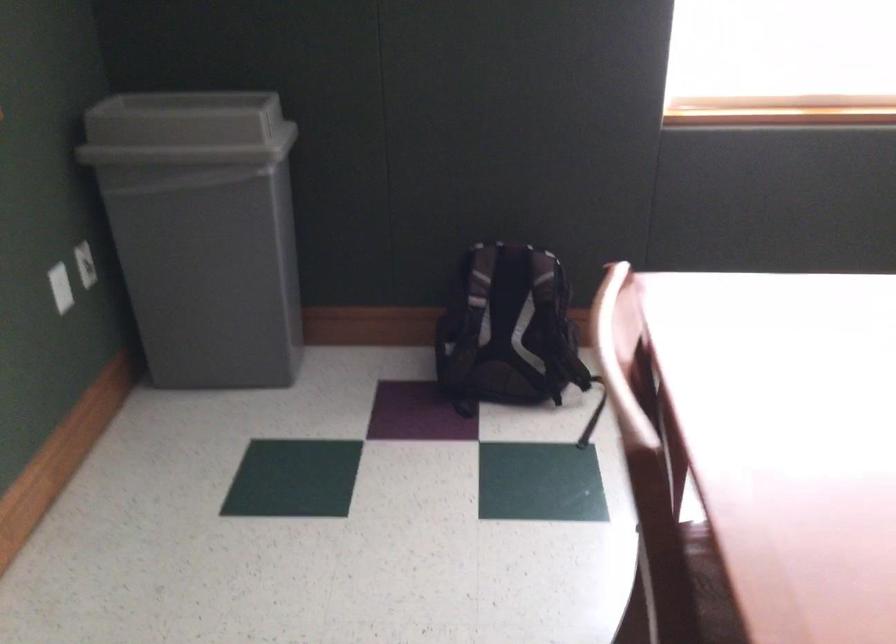
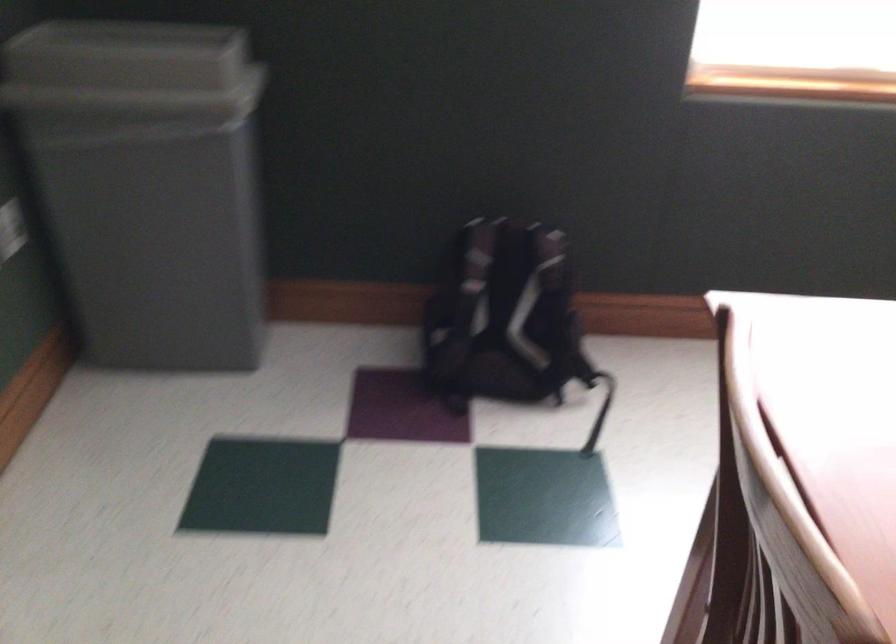
The images are taken continuously from a first-person perspective. In which direction are you moving?

Result: The movement direction of the cameraman is left, forward.